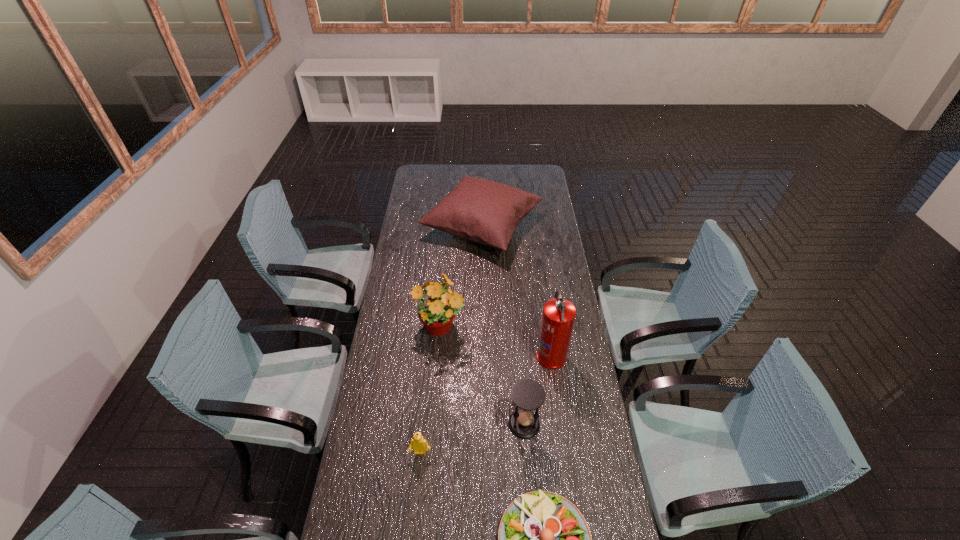
Locate an element on the screen. This screenshot has width=960, height=540. free space between the fifth farthest object and the flowerpot is located at coordinates (430, 391).

Identify the location of free spot between the fire extinguisher and the farthest object. The height and width of the screenshot is (540, 960). (516, 291).

This screenshot has width=960, height=540. What are the coordinates of `vacant space that is in between the Lego and the tallest object` in the screenshot? It's located at (486, 404).

This screenshot has height=540, width=960. In order to click on unoccupied position between the Lego and the hourglass in this screenshot , I will do `click(472, 438)`.

Where is `free space that is in between the fifth shortest object and the cushion`? free space that is in between the fifth shortest object and the cushion is located at coordinates (462, 278).

I want to click on vacant area that lies between the fourth farthest object and the flowerpot, so click(x=482, y=377).

Identify which object is located as the third nearest to the fire extinguisher. Please provide its 2D coordinates. Your answer should be formatted as a tuple, i.e. [(x, y)], where the tuple contains the x and y coordinates of a point satisfying the conditions above.

[(483, 211)]

Find the location of a particular element. the fourth closest object to the fire extinguisher is located at coordinates (543, 539).

This screenshot has height=540, width=960. What are the coordinates of `free space that satisfies the following two spatial constraints: 1. on the instruction side of the tallest object; 2. on the face of the fifth tallest object` in the screenshot? It's located at (564, 453).